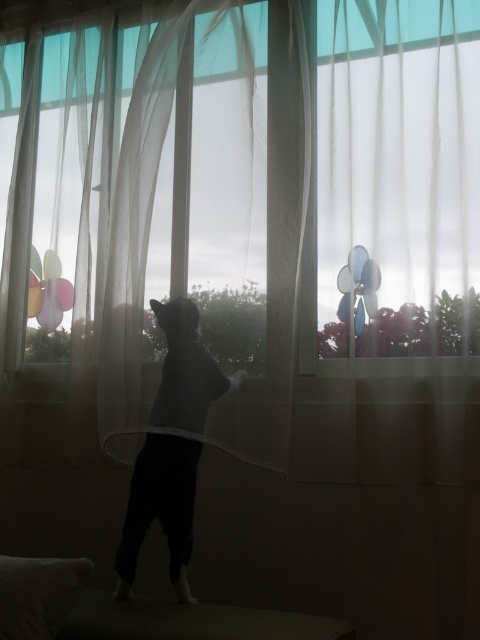
Does silhouette fur at center have a lesser width compared to white soft pillow at lower left?

No, silhouette fur at center is not thinner than white soft pillow at lower left.

Which is in front, point (175, 582) or point (36, 632)?

Point (36, 632) is in front.

You are a GUI agent. You are given a task and a screenshot of the screen. Output one action in this format:
    pyautogui.click(x=<x>, y=<y>)
    Task: Click on the silhouette fur at center
    
    Given the screenshot: What is the action you would take?
    pyautogui.click(x=160, y=508)

Can you confirm if dark brown wooden stool at lower center is positioned to the right of silhouette fur at center?

Correct, you'll find dark brown wooden stool at lower center to the right of silhouette fur at center.

Who is more distant from viewer, (x=146, y=628) or (x=178, y=557)?

The point (x=178, y=557) is behind.

I want to click on dark brown wooden stool at lower center, so click(x=131, y=611).

Does dark brown wooden stool at lower center have a lesser height compared to white soft pillow at lower left?

No, dark brown wooden stool at lower center is not shorter than white soft pillow at lower left.

Which of these two, dark brown wooden stool at lower center or white soft pillow at lower left, stands taller?

Standing taller between the two is dark brown wooden stool at lower center.

The height and width of the screenshot is (640, 480). In order to click on dark brown wooden stool at lower center in this screenshot , I will do `click(131, 611)`.